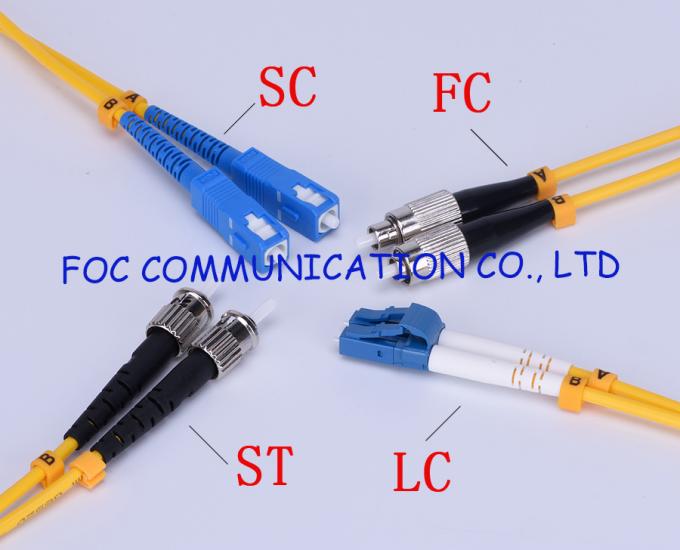
Locate an element on the screen. ethernet connectors is located at coordinates (360, 332), (367, 315).